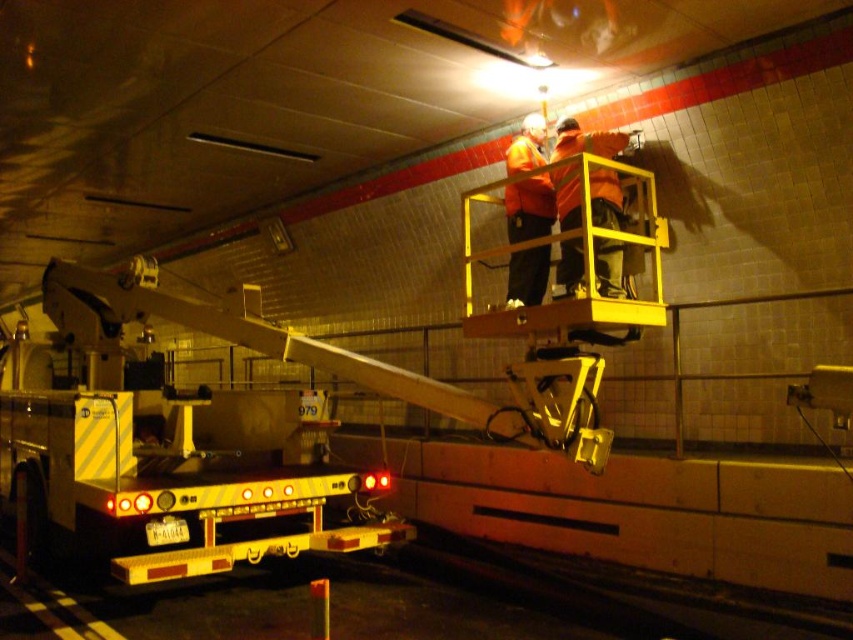
Which is in front, point (567, 186) or point (527, 184)?

Point (567, 186) is more forward.

This screenshot has width=853, height=640. What do you see at coordinates (585, 141) in the screenshot?
I see `orange reflective safety vest at center` at bounding box center [585, 141].

This screenshot has width=853, height=640. Describe the element at coordinates (585, 141) in the screenshot. I see `orange reflective safety vest at center` at that location.

Locate an element on the screen. Image resolution: width=853 pixels, height=640 pixels. orange reflective safety vest at center is located at coordinates (585, 141).